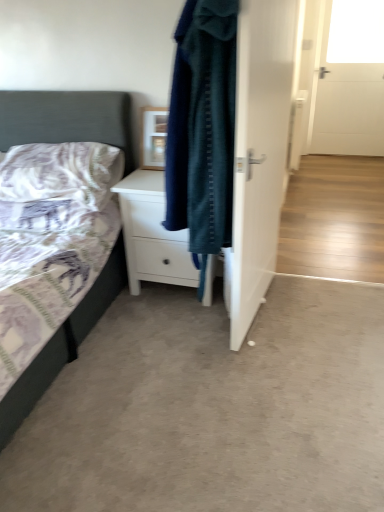
Question: Does point (213, 267) appear closer or farther from the camera than point (26, 156)?

Choices:
 (A) farther
 (B) closer

Answer: (B)

Question: In terms of width, does white matte chest of drawers at center look wider or thinner when compared to purple cotton pillow at left?

Choices:
 (A) wide
 (B) thin

Answer: (A)

Question: Which object is positioned farthest from the purple cotton pillow at left?

Choices:
 (A) textured fabric bed at left
 (B) white glossy door at center
 (C) transparent glass window at upper right
 (D) white matte chest of drawers at center
 (E) matte wooden picture frame at center

Answer: (C)

Question: Which of these objects is positioned farthest from the matte wooden picture frame at center?

Choices:
 (A) white glossy door at center
 (B) transparent glass window at upper right
 (C) textured fabric bed at left
 (D) white matte chest of drawers at center
 (E) purple cotton pillow at left

Answer: (B)